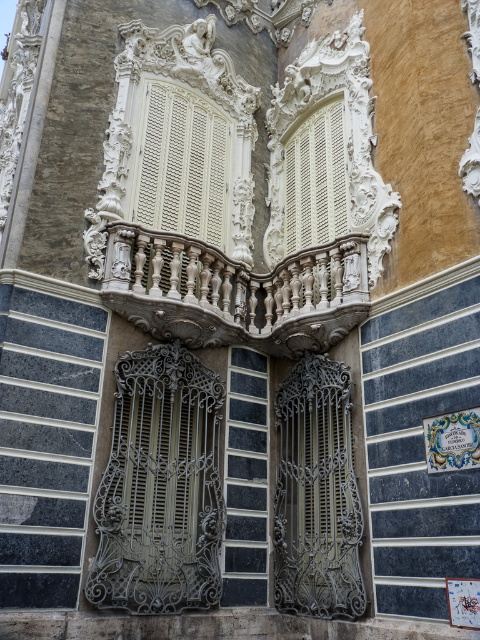
You are an architect designing a replica of this building. You need to ensure that the white carved wood balustrade at center and the white textured shutters at center are proportionate. Which object should you scale down to maintain the correct proportions?

The white carved wood balustrade at center is larger in size than the white textured shutters at center. To maintain correct proportions, you should scale down the white carved wood balustrade at center.

Looking at this image, you are an architect planning to install a new decorative element between the white carved wood balcony at center and the black glass window at center. The element requires a minimum of 40 feet of space. Based on the scene description, is there sufficient space for this installation?

The distance between the white carved wood balcony at center and the black glass window at center is 36.65 feet, which is less than the required 40 feet. Therefore, there is insufficient space for the installation.

You are an architect examining the ornate architectural details of a historical building. You notice the white carved wood balustrade at center and the white carved wood balcony at center. Which of these two features is wider?

The white carved wood balustrade at center might be wider than the white carved wood balcony at center according to the description.